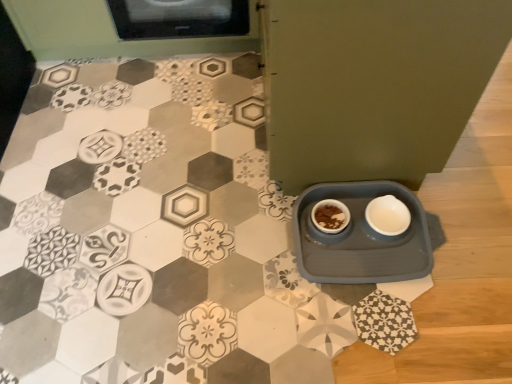
Find the location of a particular element. free space to the left of white matte bowl at lower right is located at coordinates (328, 214).